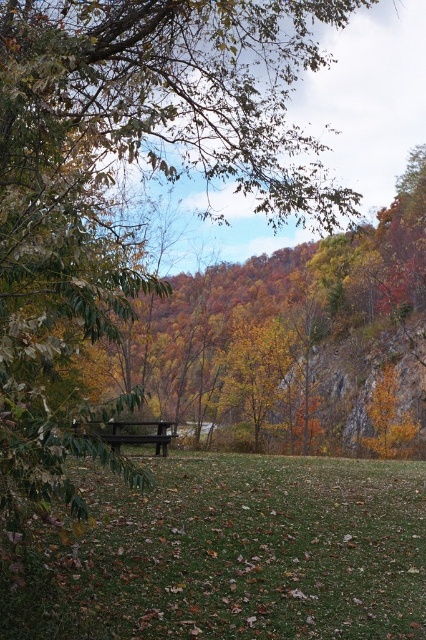
Is green grassy field at center closer to the viewer compared to wooden bench at center?

No.

Which of these two, green grassy field at center or wooden bench at center, stands shorter?

green grassy field at center is shorter.

The width and height of the screenshot is (426, 640). In order to click on green grassy field at center in this screenshot , I will do `click(233, 554)`.